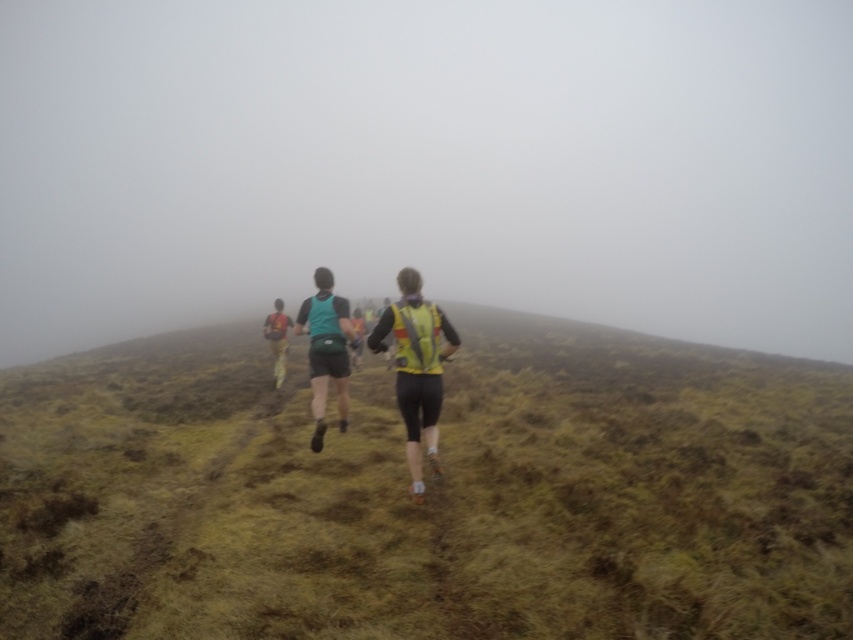
Question: Which point is farther to the camera?

Choices:
 (A) (326, 346)
 (B) (416, 346)
 (C) (749, 358)

Answer: (C)

Question: Which point is closer to the camera?

Choices:
 (A) teal fabric vest at center
 (B) yellow reflective vest at center

Answer: (A)

Question: Is teal fabric vest at center bigger than yellow reflective vest at center?

Choices:
 (A) yes
 (B) no

Answer: (B)

Question: Which point is closer to the camera?

Choices:
 (A) teal fabric vest at center
 (B) green grassy at center
 (C) reflective yellow vest at center
 (D) yellow reflective vest at center

Answer: (B)

Question: Is teal fabric vest at center to the right of yellow reflective vest at center from the viewer's perspective?

Choices:
 (A) no
 (B) yes

Answer: (B)

Question: Does green grassy at center have a greater width compared to teal fabric vest at center?

Choices:
 (A) yes
 (B) no

Answer: (A)